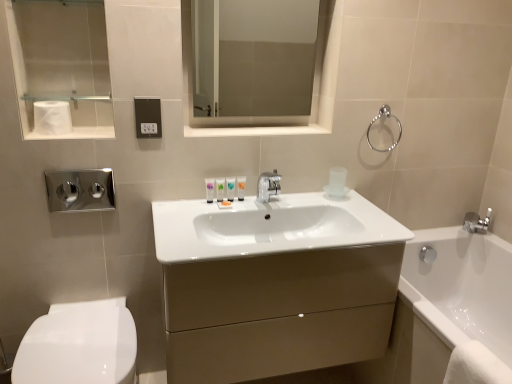
Identify the location of free space in front of translucent plastic tube at center, which is counted as the second toiletry, starting from the right. The width and height of the screenshot is (512, 384). (207, 213).